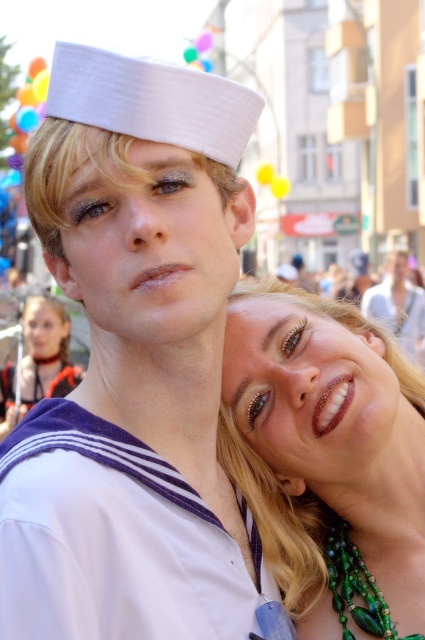
Is green beaded necklace at upper right thinner than green beaded necklace at lower right?

No, green beaded necklace at upper right is not thinner than green beaded necklace at lower right.

Can you confirm if green beaded necklace at upper right is bigger than green beaded necklace at lower right?

Correct, green beaded necklace at upper right is larger in size than green beaded necklace at lower right.

At what (x,y) coordinates should I click in order to perform the action: click on green beaded necklace at upper right. Please return your answer as a coordinate pair (x, y). The image size is (425, 640). Looking at the image, I should click on (326, 460).

Which is more to the left, green beaded necklace at upper right or matte white sailor hat at upper center?

green beaded necklace at upper right

This screenshot has width=425, height=640. Describe the element at coordinates (326, 460) in the screenshot. I see `green beaded necklace at upper right` at that location.

Which is behind, point (249, 307) or point (388, 291)?

Point (388, 291)

Locate an element on the screen. green beaded necklace at upper right is located at coordinates (326, 460).

Is point (388, 621) positioned after point (397, 252)?

That is False.

Can you confirm if green beaded necklace at lower right is positioned to the left of matte white sailor hat at upper center?

Yes, green beaded necklace at lower right is to the left of matte white sailor hat at upper center.

At what (x,y) coordinates should I click in order to perform the action: click on green beaded necklace at lower right. Please return your answer as a coordinate pair (x, y). Image resolution: width=425 pixels, height=640 pixels. Looking at the image, I should click on (356, 588).